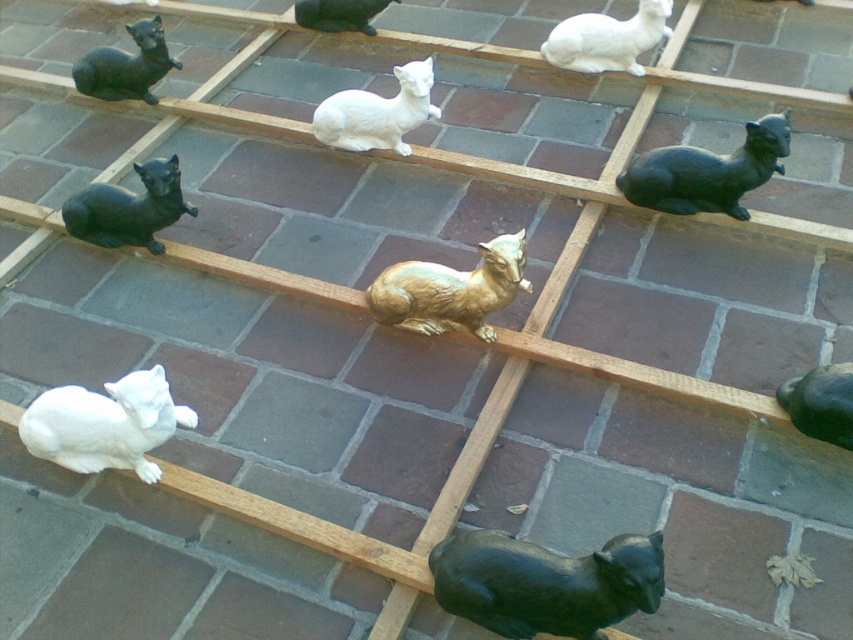
In the scene shown: Who is more distant from viewer, (613, 19) or (160, 65)?

Point (613, 19)

Where is `white glossy goat at upper center`? This screenshot has width=853, height=640. white glossy goat at upper center is located at coordinates (607, 38).

Is point (577, 580) closer to camera compared to point (65, 422)?

Yes, it is in front of point (65, 422).

Does black glossy cat at lower right have a larger size compared to white glossy cat at lower left?

Actually, black glossy cat at lower right might be smaller than white glossy cat at lower left.

This screenshot has width=853, height=640. What do you see at coordinates (544, 582) in the screenshot?
I see `black glossy cat at lower right` at bounding box center [544, 582].

I want to click on black glossy cat at lower right, so click(544, 582).

Can you confirm if black glossy cat at lower right is thinner than matte black cat at upper center?

No, black glossy cat at lower right is not thinner than matte black cat at upper center.

This screenshot has height=640, width=853. I want to click on black glossy cat at lower right, so click(544, 582).

Which is behind, point (552, 568) or point (352, 0)?

Point (352, 0)

Identify the location of black glossy cat at lower right. The height and width of the screenshot is (640, 853). (544, 582).